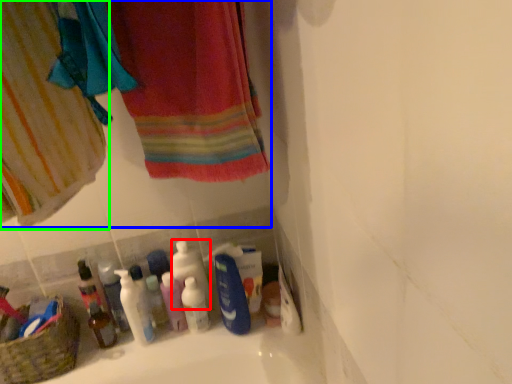
Question: Which object is the farthest from cleaning product (highlighted by a red box)? Choose among these: laundry (highlighted by a blue box) or curtain (highlighted by a green box).

Choices:
 (A) laundry
 (B) curtain

Answer: (B)